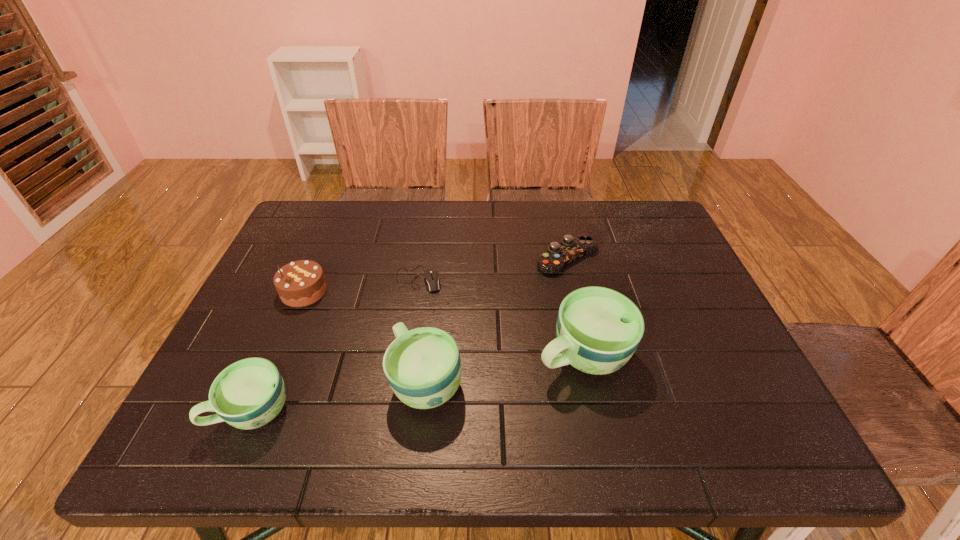
Please point a spot to add another cup on the right. Please provide its 2D coordinates. Your answer should be formatted as a tuple, i.e. [(x, y)], where the tuple contains the x and y coordinates of a point satisfying the conditions above.

[(723, 332)]